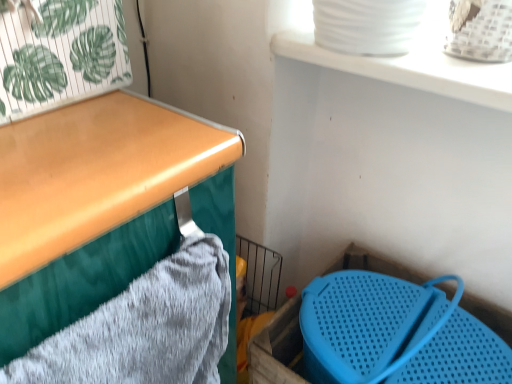
Question: Considering the relative sizes of blue plastic storage box at lower right and green leafy paper at upper left in the image provided, is blue plastic storage box at lower right wider than green leafy paper at upper left?

Choices:
 (A) yes
 (B) no

Answer: (A)

Question: From a real-world perspective, is blue plastic storage box at lower right located beneath green leafy paper at upper left?

Choices:
 (A) no
 (B) yes

Answer: (B)

Question: Is blue plastic storage box at lower right surrounding green leafy paper at upper left?

Choices:
 (A) yes
 (B) no

Answer: (B)

Question: Is blue plastic storage box at lower right to the left of green leafy paper at upper left from the viewer's perspective?

Choices:
 (A) yes
 (B) no

Answer: (B)

Question: Is blue plastic storage box at lower right far from green leafy paper at upper left?

Choices:
 (A) no
 (B) yes

Answer: (A)

Question: From their relative heights in the image, would you say green leafy paper at upper left is taller or shorter than gray textured bath towel at left?

Choices:
 (A) short
 (B) tall

Answer: (A)

Question: From the image's perspective, relative to gray textured bath towel at left, is green leafy paper at upper left above or below?

Choices:
 (A) above
 (B) below

Answer: (A)

Question: Considering the positions of green leafy paper at upper left and gray textured bath towel at left in the image, is green leafy paper at upper left wider or thinner than gray textured bath towel at left?

Choices:
 (A) thin
 (B) wide

Answer: (B)

Question: Is green leafy paper at upper left bigger or smaller than gray textured bath towel at left?

Choices:
 (A) small
 (B) big

Answer: (B)

Question: Is gray textured bath towel at left situated inside green leafy paper at upper left or outside?

Choices:
 (A) inside
 (B) outside

Answer: (B)

Question: In the image, is gray textured bath towel at left positioned in front of or behind green leafy paper at upper left?

Choices:
 (A) front
 (B) behind

Answer: (A)

Question: Is gray textured bath towel at left bigger or smaller than green leafy paper at upper left?

Choices:
 (A) big
 (B) small

Answer: (B)

Question: From a real-world perspective, relative to green leafy paper at upper left, is gray textured bath towel at left vertically above or below?

Choices:
 (A) above
 (B) below

Answer: (B)

Question: In terms of width, does blue plastic storage box at lower right look wider or thinner when compared to green leafy paper at upper left?

Choices:
 (A) thin
 (B) wide

Answer: (B)

Question: Considering their positions, is blue plastic storage box at lower right located in front of or behind green leafy paper at upper left?

Choices:
 (A) behind
 (B) front

Answer: (A)